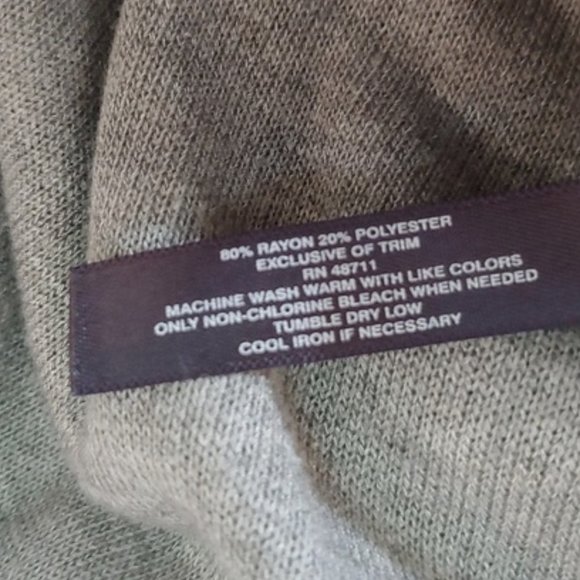
Where is `iron`? This screenshot has width=580, height=580. iron is located at coordinates (293, 343).